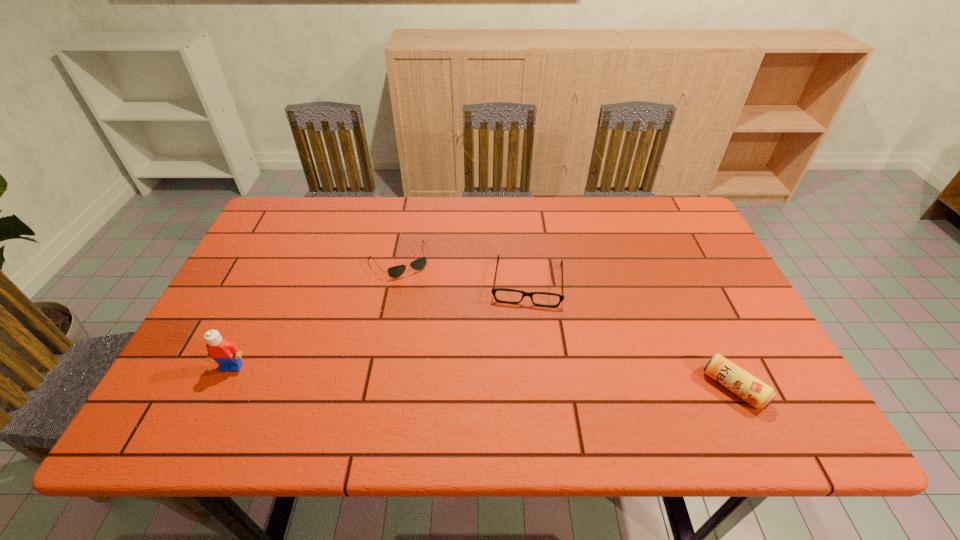
Where is `vacant area that lies between the leftmost object and the second object from left to right`? This screenshot has width=960, height=540. vacant area that lies between the leftmost object and the second object from left to right is located at coordinates (316, 314).

Find the location of `free spot between the spectacles and the rightmost object`. free spot between the spectacles and the rightmost object is located at coordinates (631, 335).

Find the location of a particular element. The height and width of the screenshot is (540, 960). vacant space that's between the spectacles and the beer can is located at coordinates (631, 335).

You are a GUI agent. You are given a task and a screenshot of the screen. Output one action in this format:
    pyautogui.click(x=<x>, y=<y>)
    Task: Click on the vacant region between the second object from right to left and the third object from right to left
    Image resolution: width=960 pixels, height=540 pixels.
    Given the screenshot: What is the action you would take?
    pyautogui.click(x=464, y=272)

You are a GUI agent. You are given a task and a screenshot of the screen. Output one action in this format:
    pyautogui.click(x=<x>, y=<y>)
    Task: Click on the vacant space that's between the tallest object and the sunglasses
    This screenshot has width=960, height=540.
    Given the screenshot: What is the action you would take?
    pyautogui.click(x=316, y=314)

Select which object appears as the second closest to the third object from right to left. Please provide its 2D coordinates. Your answer should be formatted as a tuple, i.e. [(x, y)], where the tuple contains the x and y coordinates of a point satisfying the conditions above.

[(226, 354)]

Choose which object is the nearest neighbor to the rightmost object. Please provide its 2D coordinates. Your answer should be formatted as a tuple, i.e. [(x, y)], where the tuple contains the x and y coordinates of a point satisfying the conditions above.

[(524, 293)]

I want to click on vacant area in the image that satisfies the following two spatial constraints: 1. on the front side of the beer can; 2. on the left side of the third object from right to left, so click(374, 388).

Find the location of a particular element. Image resolution: width=960 pixels, height=540 pixels. vacant position in the image that satisfies the following two spatial constraints: 1. on the face of the rightmost object; 2. on the left side of the Lego is located at coordinates (222, 388).

Where is `vacant region that satisfies the following two spatial constraints: 1. on the front side of the second object from right to left; 2. on the right side of the sunglasses`? Image resolution: width=960 pixels, height=540 pixels. vacant region that satisfies the following two spatial constraints: 1. on the front side of the second object from right to left; 2. on the right side of the sunglasses is located at coordinates (396, 282).